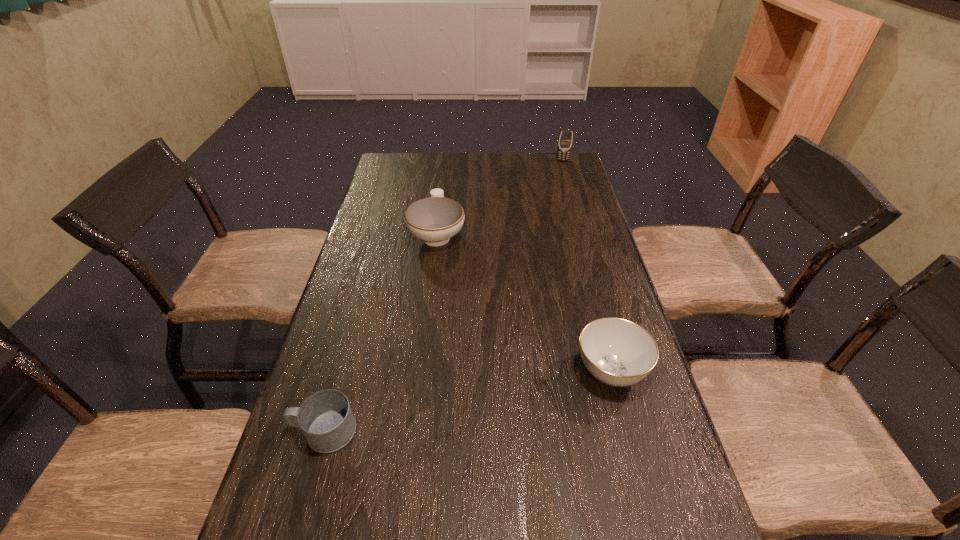
At what (x,y) coordinates should I click in order to perform the action: click on the farthest object. Please return your answer as a coordinate pair (x, y). This screenshot has height=540, width=960. Looking at the image, I should click on (565, 139).

Where is `cellular telephone`? cellular telephone is located at coordinates (565, 139).

The width and height of the screenshot is (960, 540). Find the location of `the farther chinaware`. the farther chinaware is located at coordinates (435, 219).

Identify the location of the second object from left to right. (435, 219).

You are a GUI agent. You are given a task and a screenshot of the screen. Output one action in this format:
    pyautogui.click(x=<x>, y=<y>)
    Task: Click on the nearer chinaware
    The height and width of the screenshot is (540, 960).
    Given the screenshot: What is the action you would take?
    pyautogui.click(x=617, y=352)

You are a GUI agent. You are given a task and a screenshot of the screen. Output one action in this format:
    pyautogui.click(x=<x>, y=<y>)
    Task: Click on the right chinaware
    The width and height of the screenshot is (960, 540).
    Given the screenshot: What is the action you would take?
    pyautogui.click(x=617, y=352)

You are a GUI agent. You are given a task and a screenshot of the screen. Output one action in this format:
    pyautogui.click(x=<x>, y=<y>)
    Task: Click on the mug
    This screenshot has width=960, height=540.
    Given the screenshot: What is the action you would take?
    pyautogui.click(x=326, y=419)

This screenshot has height=540, width=960. I want to click on the nearest object, so click(326, 419).

Identify the location of vacant space situated on the front face of the tallest object. The height and width of the screenshot is (540, 960). (578, 214).

The height and width of the screenshot is (540, 960). Identify the location of free space located 0.160m on the side with the handle of the third nearest object. (443, 189).